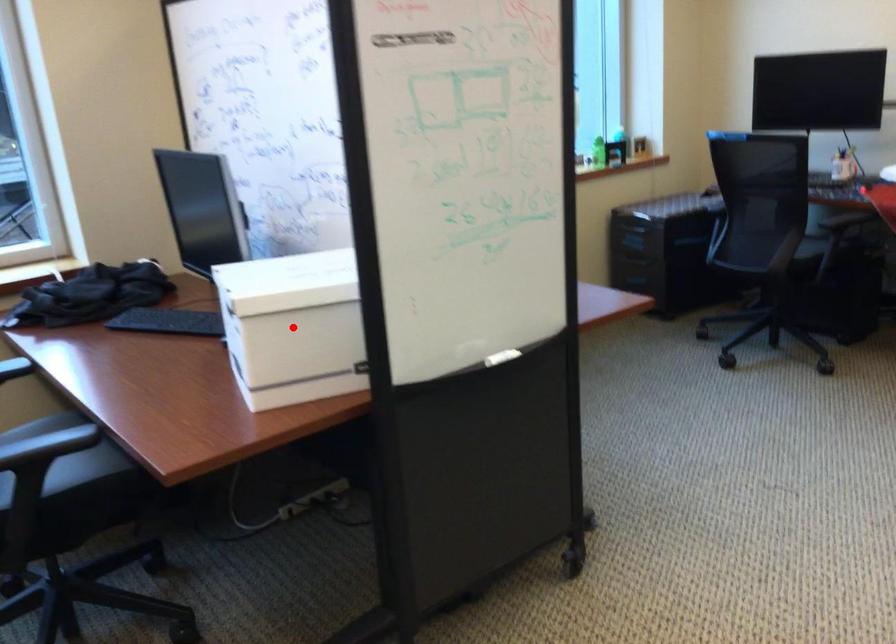
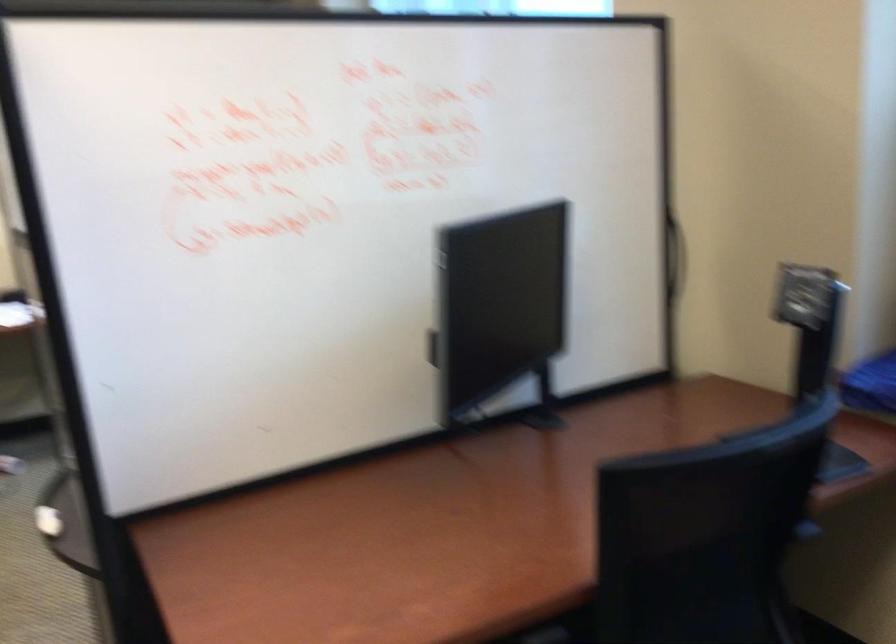
Question: I am providing you with two images of the same scene from different viewpoints. A red point is marked on the first image. Can you still see the location of the red point in image 2?

Choices:
 (A) Yes
 (B) No

Answer: (B)